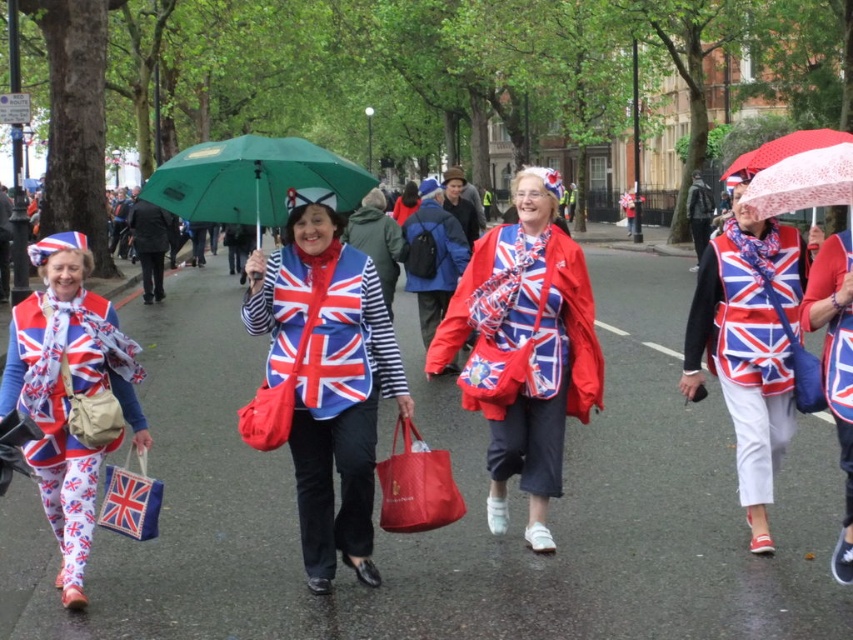
This screenshot has width=853, height=640. Describe the element at coordinates (323, 381) in the screenshot. I see `matte fabric jacket at center` at that location.

Which of these two, matte fabric jacket at center or red lace umbrella at upper right, stands taller?

matte fabric jacket at center

Between point (389, 356) and point (778, 154), which one is positioned in front?

Point (389, 356)

At what (x,y) coordinates should I click in order to perform the action: click on matte fabric jacket at center. Please return your answer as a coordinate pair (x, y). This screenshot has height=640, width=853. Looking at the image, I should click on (323, 381).

Which is in front, point (570, 288) or point (751, 273)?

Positioned in front is point (570, 288).

Does point (514, 358) come farther from viewer compared to point (767, 420)?

No, (514, 358) is closer to viewer.

This screenshot has width=853, height=640. I want to click on matte red jacket at center, so click(524, 348).

Does point (289, 230) lie in front of point (408, 528)?

No.

Between matte fabric jacket at center and matte red fabric shopping bag at center, which one has more height?

Standing taller between the two is matte fabric jacket at center.

What do you see at coordinates (323, 381) in the screenshot?
I see `matte fabric jacket at center` at bounding box center [323, 381].

At what (x,y) coordinates should I click in order to perform the action: click on matte fabric jacket at center. Please return your answer as a coordinate pair (x, y). The height and width of the screenshot is (640, 853). Looking at the image, I should click on (323, 381).